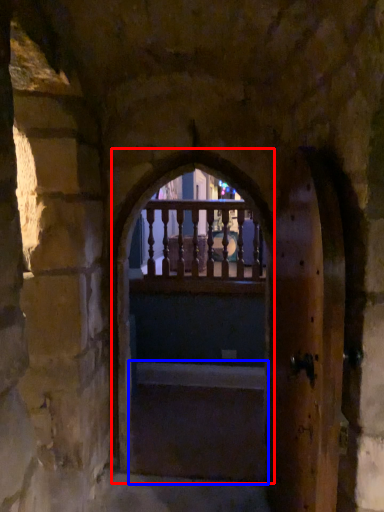
Question: Among these objects, which one is farthest to the camera, window frame (highlighted by a red box) or stairs (highlighted by a blue box)?

Choices:
 (A) window frame
 (B) stairs

Answer: (B)